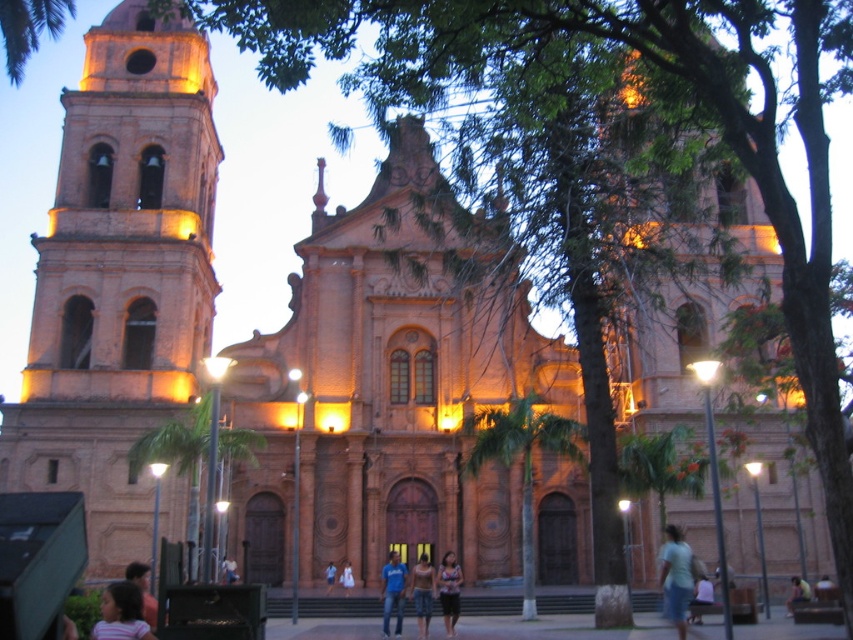
You are standing in the plaza in front of the church and notice the light blue denim shorts at lower right. If you want to pick them up, in which direction should you move relative to your current position?

The light blue denim shorts at lower right are located at point 0.934 on the x and 0.822 on the y axis. Since the lower right corner is the origin point, you should move towards the lower right direction to reach them.

You are a photographer standing in front of the church and want to capture both the light blue denim shorts at lower right and the light blue denim shorts at center in a single photo. Which pair of shorts will appear smaller in the final photo?

The light blue denim shorts at lower right will appear smaller in the final photo because it is smaller than the light blue denim shorts at center.

You are a photographer standing in front of the church and see both the matte pink tank top at center and the light brown fabric dress at center. Which clothing item should you focus on to capture a larger subject in your photo?

The matte pink tank top at center is larger in size than the light brown fabric dress at center, so focusing on the matte pink tank top at center will capture a larger subject in your photo.